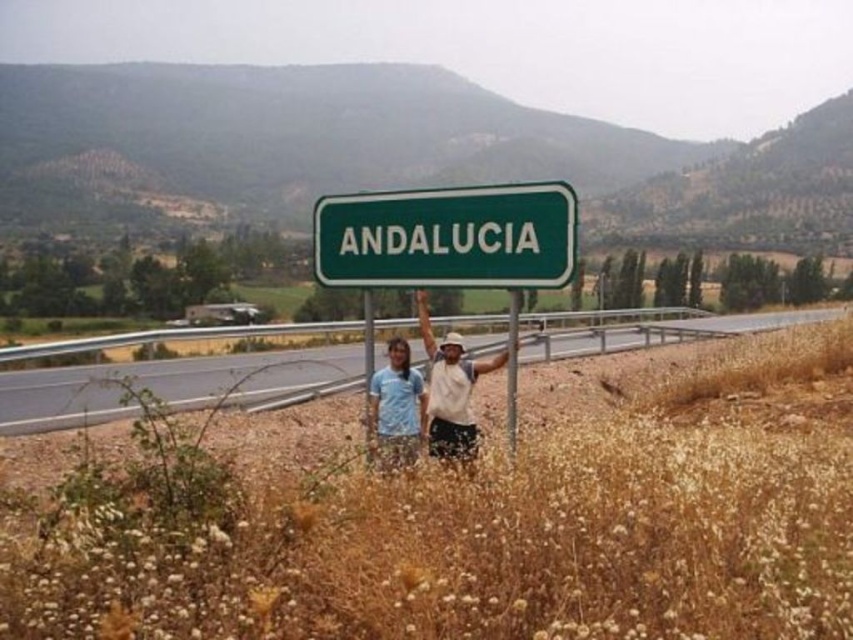
Is point (350, 246) farther from camera compared to point (289, 368)?

That is False.

Is green metallic sign at center below gray asphalt highway at center?

Incorrect, green metallic sign at center is not positioned below gray asphalt highway at center.

Locate an element on the screen. green metallic sign at center is located at coordinates (447, 237).

Can you confirm if white cotton shirt at center is wider than green plastic sign at center?

Yes, white cotton shirt at center is wider than green plastic sign at center.

Identify the location of white cotton shirt at center. Image resolution: width=853 pixels, height=640 pixels. (451, 388).

Identify the location of white cotton shirt at center. This screenshot has width=853, height=640. (451, 388).

Is gray asphalt highway at center positioned before blue fabric pants at center?

Yes, it is.

Can you confirm if gray asphalt highway at center is smaller than blue fabric pants at center?

No, gray asphalt highway at center is not smaller than blue fabric pants at center.

Between point (657, 337) and point (381, 369), which one is positioned in front?

Point (381, 369)

Image resolution: width=853 pixels, height=640 pixels. I want to click on gray asphalt highway at center, so click(161, 385).